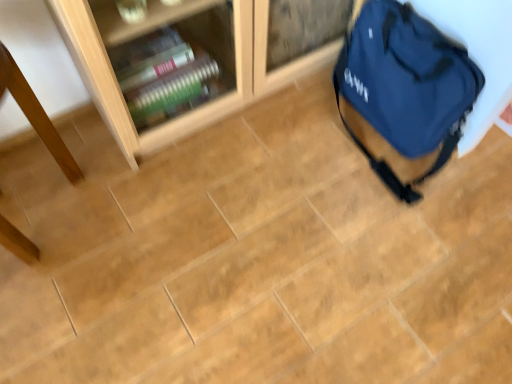
Question: Is point (12, 61) positioned closer to the camera than point (424, 140)?

Choices:
 (A) closer
 (B) farther

Answer: (A)

Question: In terms of height, does wooden table at left look taller or shorter compared to blue fabric backpack at right?

Choices:
 (A) tall
 (B) short

Answer: (A)

Question: From the image's perspective, relative to blue fabric backpack at right, is wooden table at left above or below?

Choices:
 (A) below
 (B) above

Answer: (A)

Question: Does point (437, 110) appear closer or farther from the camera than point (3, 66)?

Choices:
 (A) closer
 (B) farther

Answer: (B)

Question: In terms of size, does blue fabric backpack at right appear bigger or smaller than wooden table at left?

Choices:
 (A) small
 (B) big

Answer: (A)

Question: Choose the correct answer: Is blue fabric backpack at right inside wooden table at left or outside it?

Choices:
 (A) outside
 (B) inside

Answer: (A)

Question: Considering their positions, is blue fabric backpack at right located in front of or behind wooden table at left?

Choices:
 (A) behind
 (B) front

Answer: (A)